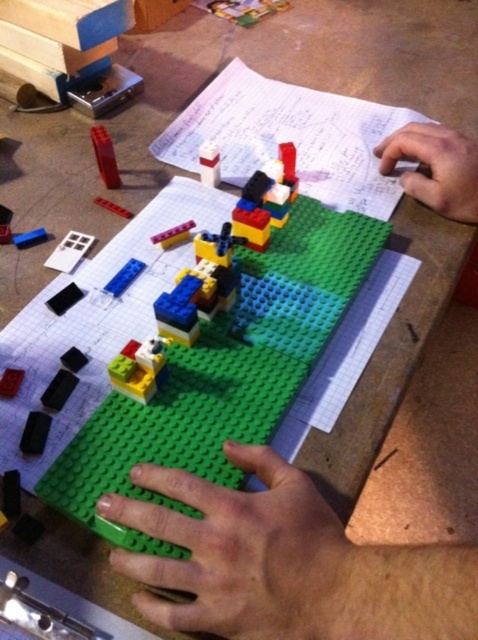
Question: Does green matte lego bricks at center appear under translucent plastic brick at center?

Choices:
 (A) yes
 (B) no

Answer: (A)

Question: Can you confirm if translucent blue plastic at center is positioned above matte red brick at upper left?

Choices:
 (A) no
 (B) yes

Answer: (A)

Question: Which point is farther to the camera?

Choices:
 (A) skinny white hand at upper right
 (B) black matte brick at lower left
 (C) green matte lego bricks at center

Answer: (A)

Question: Can you confirm if black matte brick at lower left is positioned to the left of blue matte rectangular block at center-left?

Choices:
 (A) no
 (B) yes

Answer: (B)

Question: Among these objects, which one is farthest from the camera?

Choices:
 (A) blue matte rectangular block at center-left
 (B) green matte hand at lower center

Answer: (A)

Question: Which object is positioned closest to the translucent blue plastic at center?

Choices:
 (A) green matte lego bricks at center
 (B) black matte brick at lower left

Answer: (B)